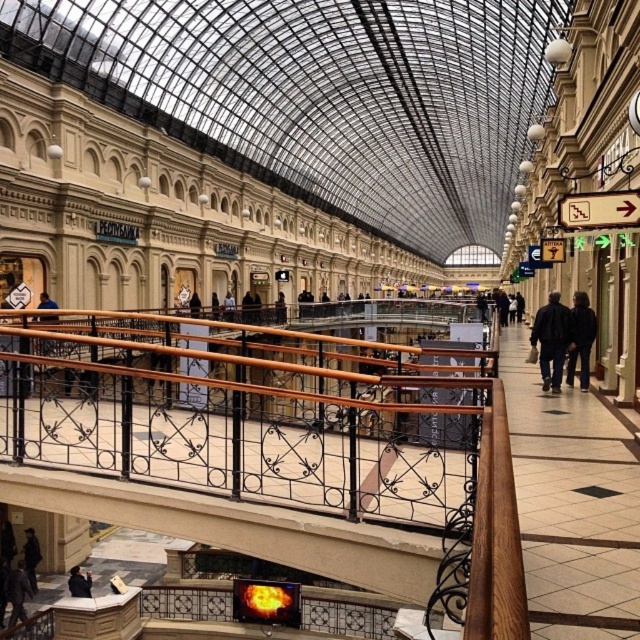
Is point (582, 365) positioned before point (81, 586)?

Yes, it is in front of point (81, 586).

Can you confirm if dark blue jacket at center is positioned below dark gray jacket at lower left?

Incorrect, dark blue jacket at center is not positioned below dark gray jacket at lower left.

Who is more distant from viewer, (x=570, y=362) or (x=74, y=576)?

The point (x=74, y=576) is more distant.

The width and height of the screenshot is (640, 640). I want to click on dark blue jacket at center, so click(580, 339).

Is dark brown leather jacket at lower left closer to the viewer compared to matte black jacket at lower left?

No, dark brown leather jacket at lower left is behind matte black jacket at lower left.

Who is positioned more to the left, dark brown leather jacket at lower left or matte black jacket at lower left?

Positioned to the left is dark brown leather jacket at lower left.

This screenshot has width=640, height=640. I want to click on dark brown leather jacket at lower left, so click(x=17, y=593).

Does dark gray jacket at lower left have a lesser height compared to matte black jacket at lower left?

Correct, dark gray jacket at lower left is not as tall as matte black jacket at lower left.

Which is below, dark gray jacket at lower left or matte black jacket at lower left?

dark gray jacket at lower left is below.

Which is behind, point (77, 582) or point (54, 301)?

The point (54, 301) is behind.

Locate an element on the screen. The image size is (640, 640). dark gray jacket at lower left is located at coordinates (80, 582).